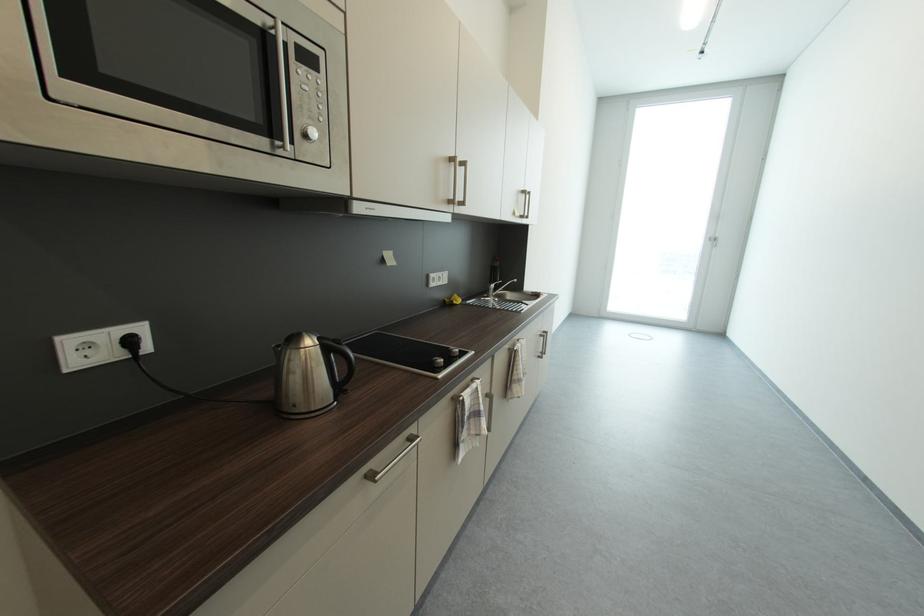
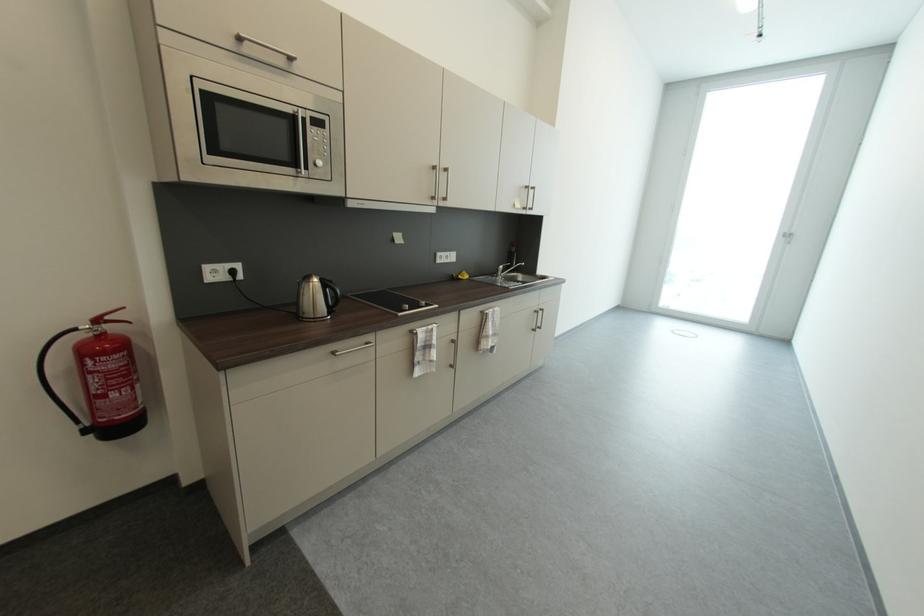
Where in the second image is the point corresponding to point (719, 241) from the first image?

(794, 238)